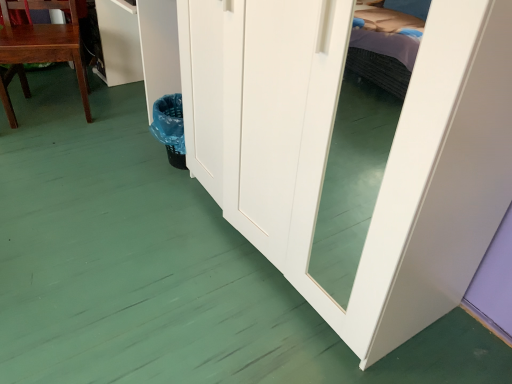
Question: Is matte wood chair at left in front of or behind white glossy cabinet at upper left in the image?

Choices:
 (A) behind
 (B) front

Answer: (B)

Question: Considering the positions of point (14, 33) and point (117, 64), is point (14, 33) closer or farther from the camera than point (117, 64)?

Choices:
 (A) closer
 (B) farther

Answer: (A)

Question: In the image, is matte wood chair at left on the left side or the right side of white glossy cabinet at upper left?

Choices:
 (A) left
 (B) right

Answer: (A)

Question: Would you say white glossy cabinet at upper left is inside or outside matte wood chair at left?

Choices:
 (A) outside
 (B) inside

Answer: (A)

Question: In terms of width, does white glossy cabinet at upper left look wider or thinner when compared to matte wood chair at left?

Choices:
 (A) thin
 (B) wide

Answer: (A)

Question: From their relative heights in the image, would you say white glossy cabinet at upper left is taller or shorter than matte wood chair at left?

Choices:
 (A) short
 (B) tall

Answer: (A)

Question: Is white glossy cabinet at upper left bigger or smaller than matte wood chair at left?

Choices:
 (A) big
 (B) small

Answer: (B)